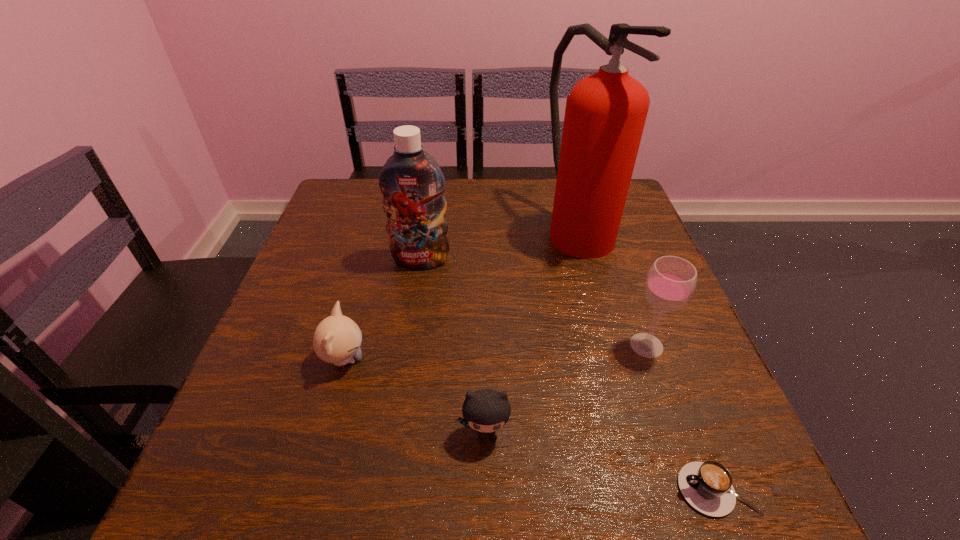
Locate an element on the screen. This screenshot has height=540, width=960. object located at the left edge is located at coordinates (337, 339).

Where is `fire extinguisher that is positioned at the right edge`? This screenshot has width=960, height=540. fire extinguisher that is positioned at the right edge is located at coordinates (605, 114).

The height and width of the screenshot is (540, 960). I want to click on wineglass that is at the right edge, so [671, 280].

The image size is (960, 540). What are the coordinates of `cappuccino that is at the right edge` in the screenshot? It's located at (707, 486).

I want to click on object situated at the far right corner, so click(x=605, y=114).

Locate an element on the screen. Image resolution: width=960 pixels, height=540 pixels. object that is at the near right corner is located at coordinates (707, 486).

This screenshot has width=960, height=540. In order to click on vacant space at the far edge of the desktop in this screenshot , I will do `click(523, 225)`.

Find the location of a particular element. This screenshot has height=540, width=960. vacant space at the near edge is located at coordinates (337, 516).

At what (x,y) coordinates should I click in order to perform the action: click on vacant space at the left edge of the desktop. Please return your answer as a coordinate pair (x, y). Looking at the image, I should click on (300, 438).

Where is `free space at the right edge`? This screenshot has height=540, width=960. free space at the right edge is located at coordinates (611, 260).